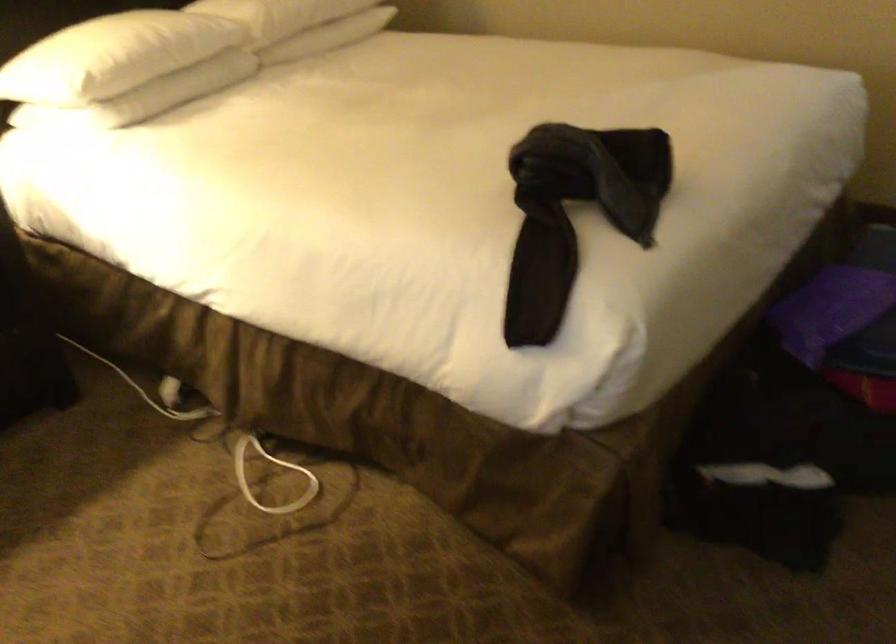
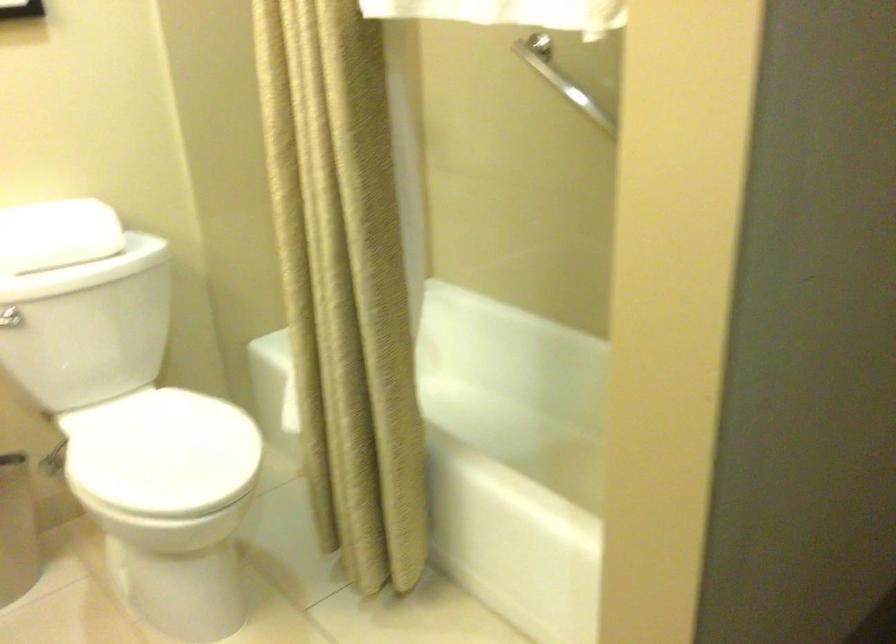
The images are taken continuously from a first-person perspective. In which direction are you moving?

The movement direction of the cameraman is right, forward.